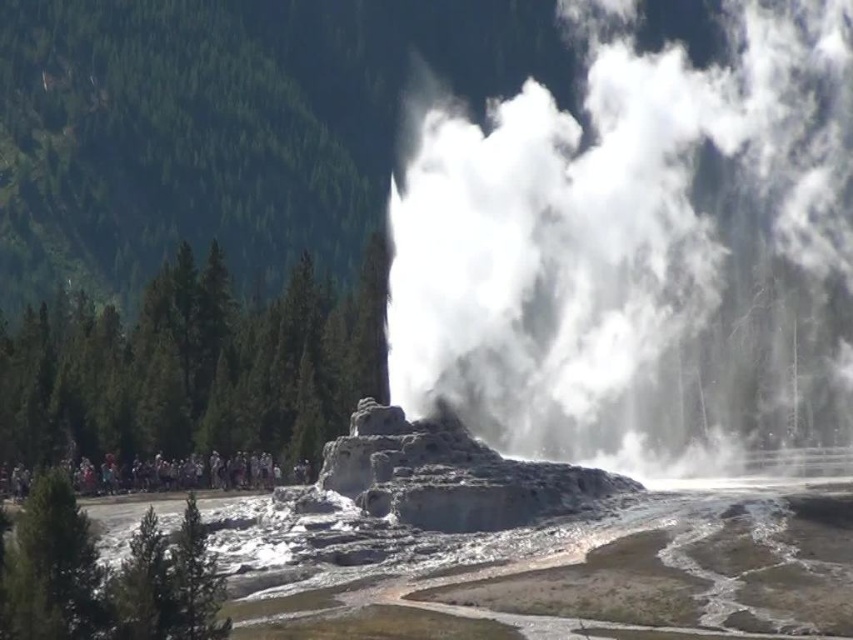
Question: Does white vapor at center come in front of multicolored clothing at lower left?

Choices:
 (A) no
 (B) yes

Answer: (B)

Question: Which of the following is the closest to the observer?

Choices:
 (A) (711, 419)
 (B) (154, 456)

Answer: (B)

Question: Is white vapor at center further to camera compared to multicolored clothing at lower left?

Choices:
 (A) yes
 (B) no

Answer: (B)

Question: Where is white vapor at center located in relation to multicolored clothing at lower left in the image?

Choices:
 (A) right
 (B) left

Answer: (A)

Question: Among these points, which one is nearest to the camera?

Choices:
 (A) (267, 474)
 (B) (403, 317)

Answer: (B)

Question: Which point is closer to the camera?

Choices:
 (A) white vapor at center
 (B) multicolored clothing at lower left

Answer: (A)